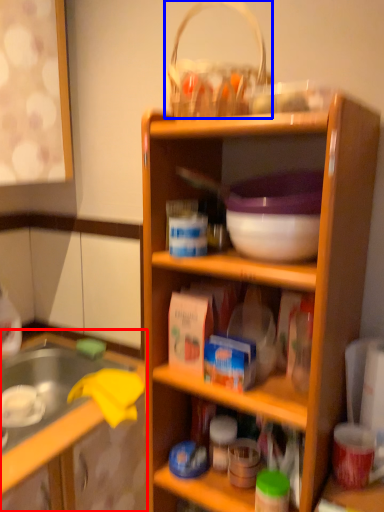
Question: Which object is further to the camera taking this photo, cabinetry (highlighted by a red box) or basket (highlighted by a blue box)?

Choices:
 (A) cabinetry
 (B) basket

Answer: (A)